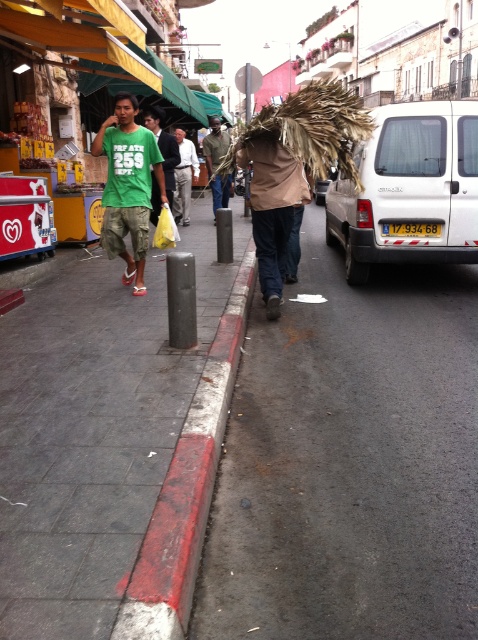
Question: Is red painted concrete curb at lower center closer to camera compared to green matte t-shirt at center?

Choices:
 (A) no
 (B) yes

Answer: (B)

Question: Can you confirm if brown woven basket at center is thinner than light brown fabric bag at center?

Choices:
 (A) no
 (B) yes

Answer: (A)

Question: Which of the following is the farthest from the observer?

Choices:
 (A) [412, 595]
 (B) [453, 140]

Answer: (B)

Question: Which point is farther from the camera taking this photo?

Choices:
 (A) (431, 234)
 (B) (213, 124)
 (C) (166, 179)

Answer: (B)

Question: In this image, where is white matte van at right located relative to green matte t-shirt at center?

Choices:
 (A) left
 (B) right

Answer: (B)

Question: Which object appears farthest from the camera in this image?

Choices:
 (A) brown woven basket at center
 (B) yellow plastic license plate at center
 (C) red painted concrete curb at lower center

Answer: (A)